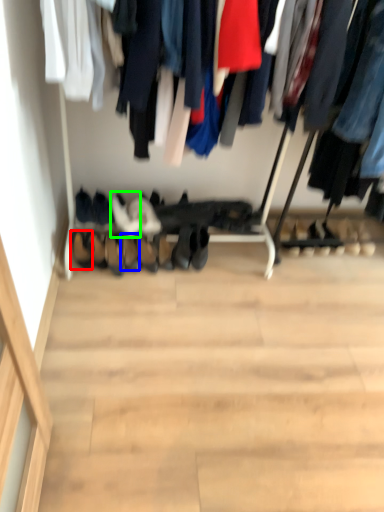
Question: Which object is the farthest from shoe (highlighted by a red box)? Choose among these: shoe (highlighted by a blue box) or footwear (highlighted by a green box).

Choices:
 (A) shoe
 (B) footwear

Answer: (B)